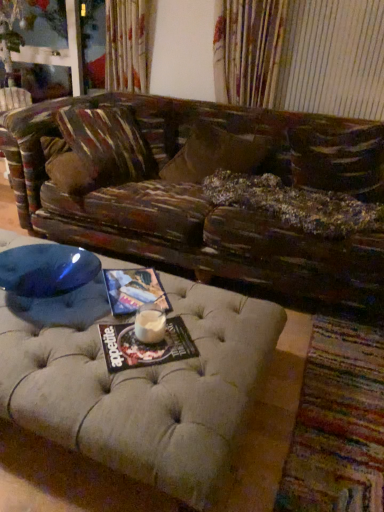
I want to click on empty space that is ontop of matte paper magazine at center, the second magazine viewed from the top (from a real-world perspective), so click(x=140, y=333).